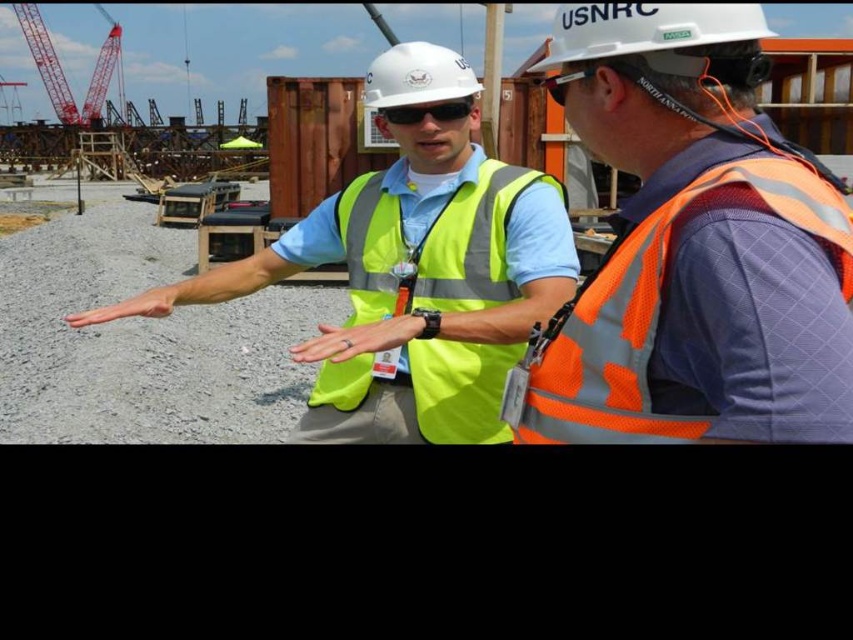
Between orange reflective safety vest at right and white hard hat at center, which one appears on the right side from the viewer's perspective?

From the viewer's perspective, orange reflective safety vest at right appears more on the right side.

Is orange reflective safety vest at right to the left of white hard hat at center from the viewer's perspective?

Incorrect, orange reflective safety vest at right is not on the left side of white hard hat at center.

What do you see at coordinates (703, 312) in the screenshot?
I see `orange reflective safety vest at right` at bounding box center [703, 312].

Identify the location of orange reflective safety vest at right. The height and width of the screenshot is (640, 853). (703, 312).

Is point (405, 228) farther from viewer compared to point (578, 13)?

Yes, point (405, 228) is farther from viewer.

Is high-visibility yellow vest at center wider than white hard hat at upper center?

Indeed, high-visibility yellow vest at center has a greater width compared to white hard hat at upper center.

Which is behind, point (415, 205) or point (688, 8)?

Positioned behind is point (415, 205).

This screenshot has height=640, width=853. I want to click on high-visibility yellow vest at center, so click(424, 285).

The width and height of the screenshot is (853, 640). What are the coordinates of `orange reflective safety vest at right` in the screenshot? It's located at (703, 312).